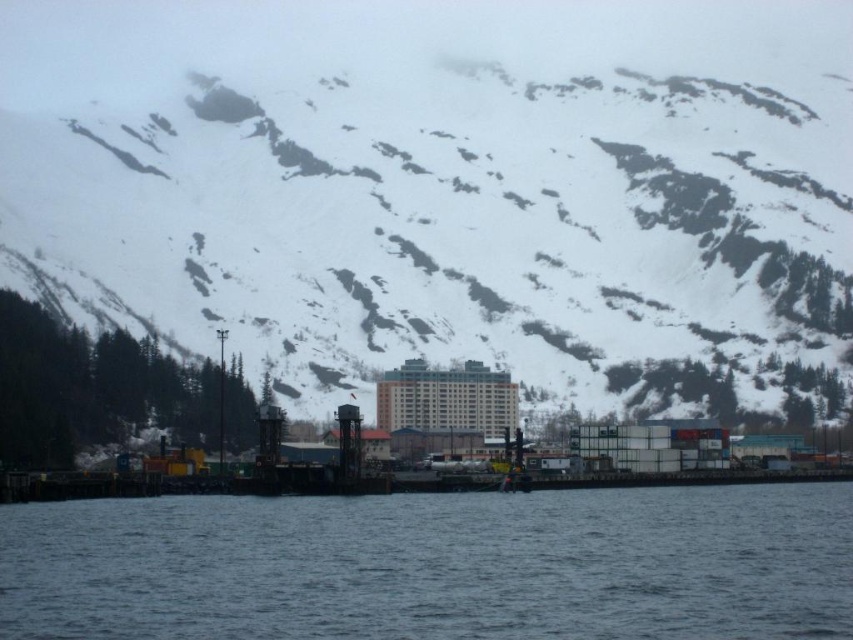
Between snowy rock at upper center and dark blue water at lower center, which one is positioned higher?

Positioned higher is snowy rock at upper center.

Does snowy rock at upper center appear on the right side of dark blue water at lower center?

Incorrect, snowy rock at upper center is not on the right side of dark blue water at lower center.

Who is more distant from viewer, (780, 205) or (236, 616)?

The point (780, 205) is behind.

Where is `snowy rock at upper center`? The image size is (853, 640). snowy rock at upper center is located at coordinates (448, 221).